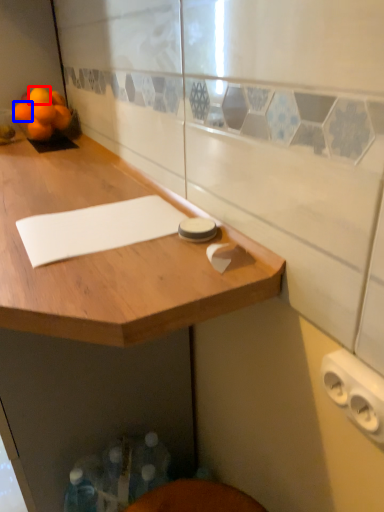
Question: Which of the following is the closest to the observer, orange (highlighted by a red box) or orange (highlighted by a blue box)?

Choices:
 (A) orange
 (B) orange

Answer: (B)